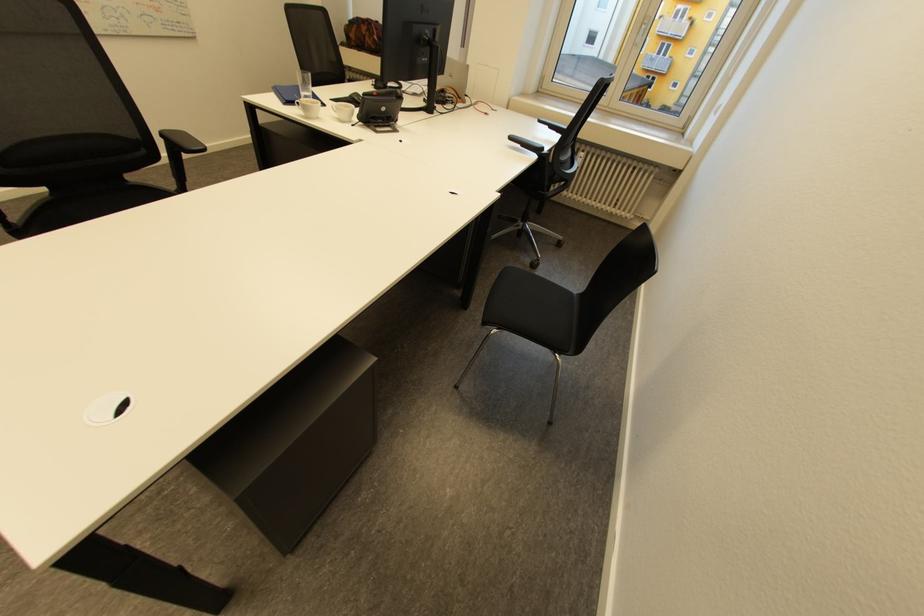
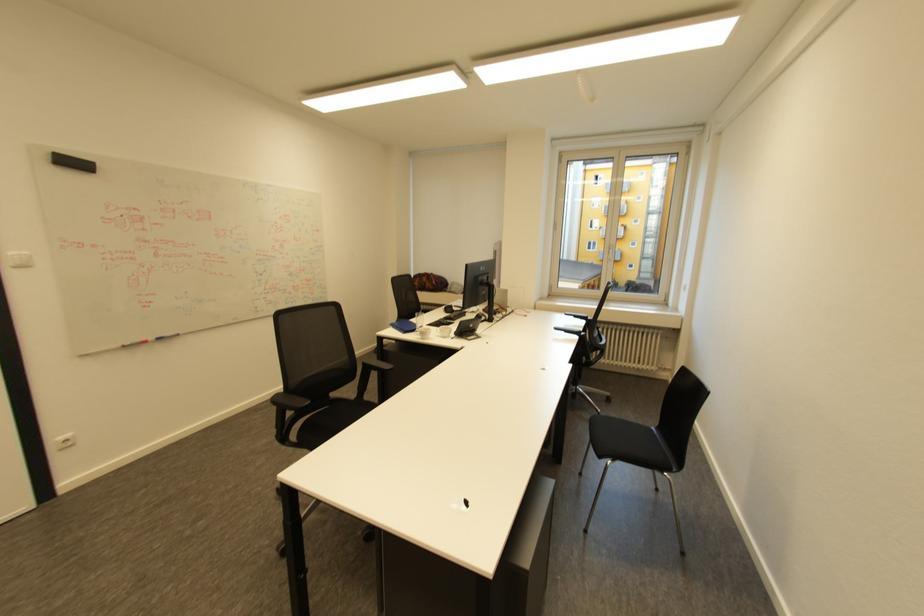
Find the pixel in the second image that matches (309,113) in the first image.

(426, 337)